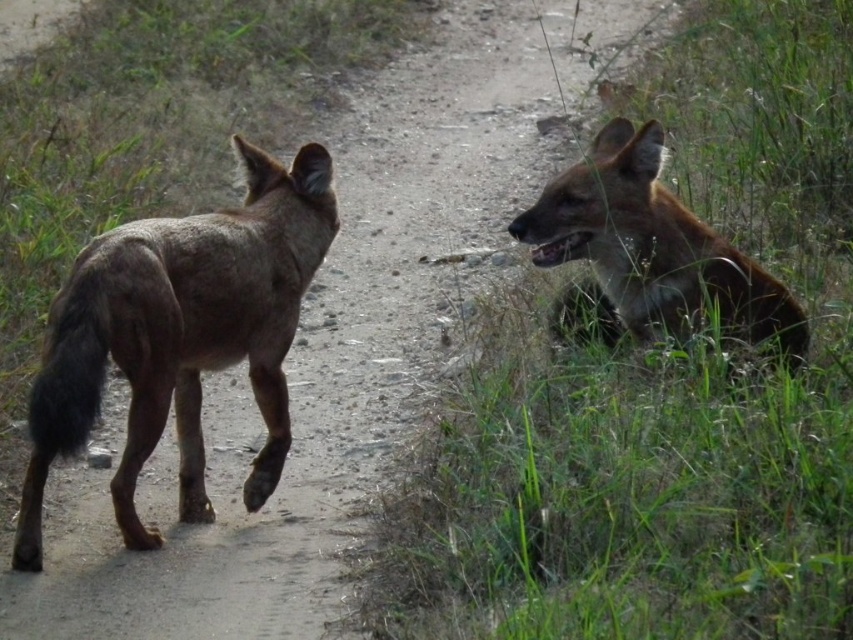
Which is behind, point (701, 115) or point (77, 369)?

Point (701, 115)

Does green grass at lower right have a lesser width compared to brown fur dog at left?

In fact, green grass at lower right might be wider than brown fur dog at left.

Who is more forward, (x=703, y=390) or (x=57, y=420)?

Point (x=57, y=420) is in front.

Image resolution: width=853 pixels, height=640 pixels. What are the coordinates of `green grass at lower right` in the screenshot? It's located at (660, 396).

Is point (154, 288) in front of point (662, 262)?

Yes, point (154, 288) is closer to viewer.

This screenshot has height=640, width=853. What do you see at coordinates (180, 336) in the screenshot?
I see `brown fur dog at left` at bounding box center [180, 336].

Is point (62, 380) behind point (677, 209)?

No.

At what (x,y) coordinates should I click in order to perform the action: click on brown fur dog at left. Please return your answer as a coordinate pair (x, y). Looking at the image, I should click on (180, 336).

Does green grass at lower right lie in front of brown fur hyaena at right?

That is True.

Find the location of a particular element. green grass at lower right is located at coordinates (660, 396).

Image resolution: width=853 pixels, height=640 pixels. Identify the location of green grass at lower right. (660, 396).